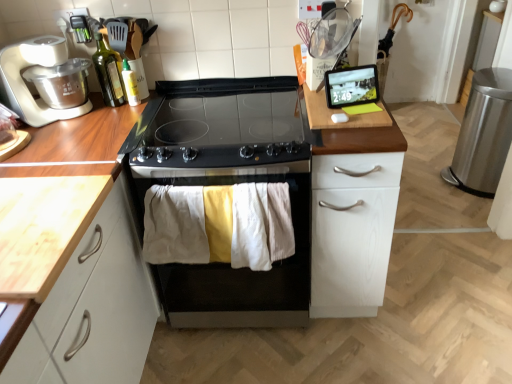
Locate an element on the screen. Image resolution: width=512 pixels, height=384 pixels. vacant space in front of white matte cabinet at right is located at coordinates (366, 352).